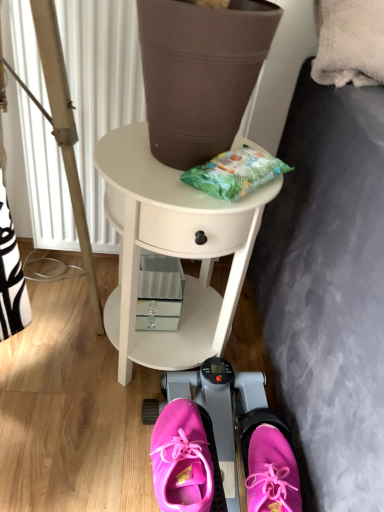
Question: From a real-world perspective, relative to pink fabric shoe at lower center, which is counted as the 1th footwear, starting from the left, is wooden tripod at left vertically above or below?

Choices:
 (A) below
 (B) above

Answer: (B)

Question: Is wooden tripod at left to the left or to the right of pink fabric shoe at lower center, which is counted as the 1th footwear, starting from the left, in the image?

Choices:
 (A) left
 (B) right

Answer: (A)

Question: Estimate the real-world distances between objects in this image. Which object is farther from the pink fabric sneakers at lower center, arranged as the 1th footwear when viewed from the right?

Choices:
 (A) white glossy side table at center
 (B) pink fabric shoe at lower center, which is counted as the 1th footwear, starting from the left
 (C) wooden tripod at left
 (D) pink fabric sneakers at center

Answer: (C)

Question: Estimate the real-world distances between objects in this image. Which object is closer to the pink fabric sneakers at lower center, arranged as the 1th footwear when viewed from the right?

Choices:
 (A) pink fabric shoe at lower center, the second footwear in the right-to-left sequence
 (B) white glossy side table at center
 (C) pink fabric sneakers at center
 (D) wooden tripod at left

Answer: (C)